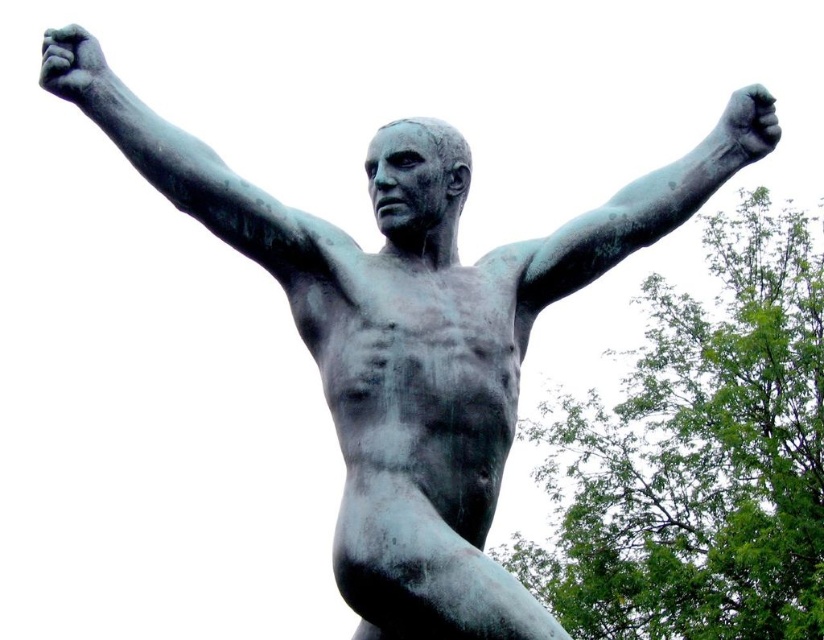
Question: Among these objects, which one is nearest to the camera?

Choices:
 (A) bronze/rough arm at upper right
 (B) bronze/smooth arm at upper left

Answer: (B)

Question: Is bronze/smooth arm at upper left further to the viewer compared to bronze/rough arm at upper right?

Choices:
 (A) no
 (B) yes

Answer: (A)

Question: From the image, what is the correct spatial relationship of bronze/smooth arm at upper left in relation to bronze/rough arm at upper right?

Choices:
 (A) below
 (B) above

Answer: (B)

Question: Which of the following is the closest to the observer?

Choices:
 (A) click(x=328, y=266)
 (B) click(x=616, y=218)

Answer: (A)

Question: Can you confirm if bronze/smooth arm at upper left is bigger than bronze/rough arm at upper right?

Choices:
 (A) no
 (B) yes

Answer: (A)

Question: Which point is farther from the camera taking this photo?

Choices:
 (A) pyautogui.click(x=673, y=182)
 (B) pyautogui.click(x=134, y=104)

Answer: (A)